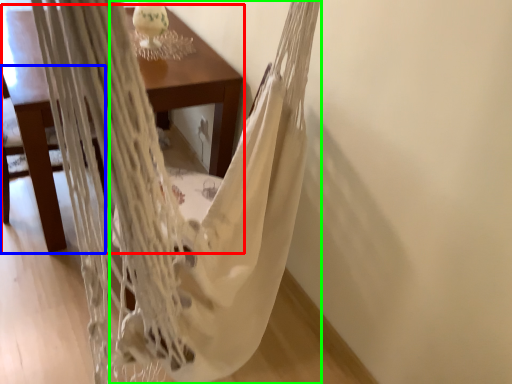
Question: Which is farther away from table (highlighted by a red box)? armchair (highlighted by a blue box) or blanket (highlighted by a green box)?

Choices:
 (A) armchair
 (B) blanket

Answer: (A)